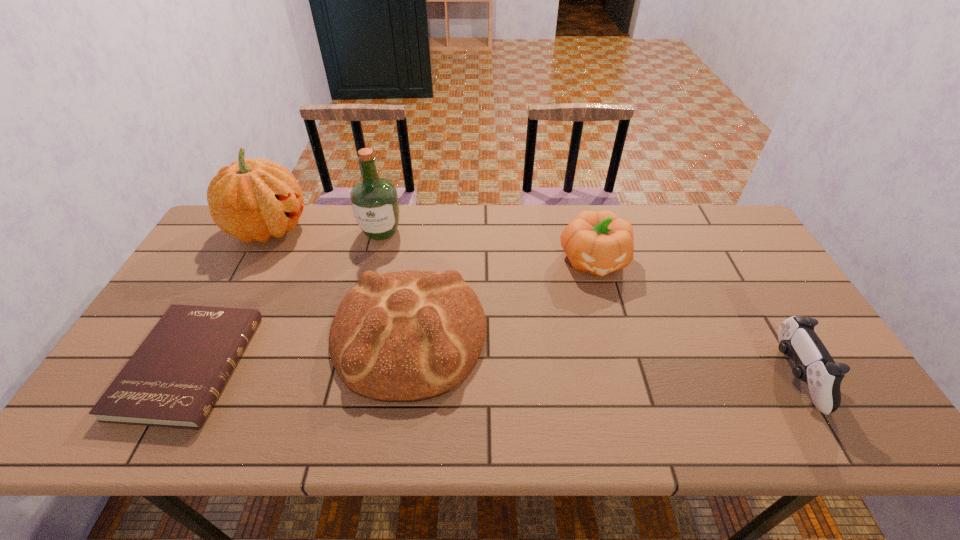
At what (x,y) coordinates should I click in order to perform the action: click on object that is at the right edge. Please return your answer as a coordinate pair (x, y). The width and height of the screenshot is (960, 540). Looking at the image, I should click on (797, 339).

This screenshot has width=960, height=540. Find the location of `object at the far left corner`. object at the far left corner is located at coordinates (251, 200).

I want to click on object positioned at the near left corner, so click(x=173, y=379).

What are the coordinates of `object located in the near right corner section of the desktop` in the screenshot? It's located at (797, 339).

Where is `vacant position at the far edge of the desktop`? The image size is (960, 540). vacant position at the far edge of the desktop is located at coordinates (634, 207).

Identify the location of vacant point at the near edge. (430, 440).

The width and height of the screenshot is (960, 540). Identify the location of free space at the left edge. (194, 266).

The height and width of the screenshot is (540, 960). Find the location of `free space at the far right corner of the desktop`. free space at the far right corner of the desktop is located at coordinates (693, 228).

Image resolution: width=960 pixels, height=540 pixels. In order to click on free space at the near right corner of the desktop in this screenshot , I will do `click(844, 429)`.

This screenshot has height=540, width=960. I want to click on vacant area that lies between the liquor and the taller pumpkin, so click(x=324, y=230).